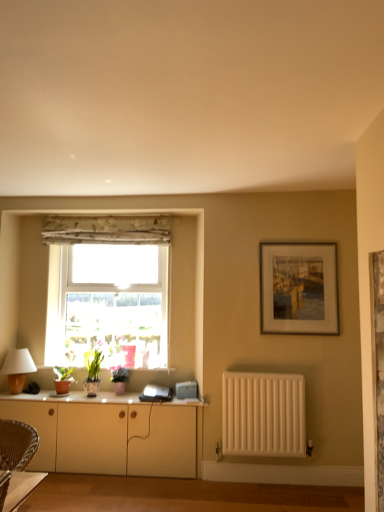
Image resolution: width=384 pixels, height=512 pixels. What are the coordinates of `free point above wooden framed painting at upper right (from a real-world perspective)` in the screenshot? It's located at (305, 236).